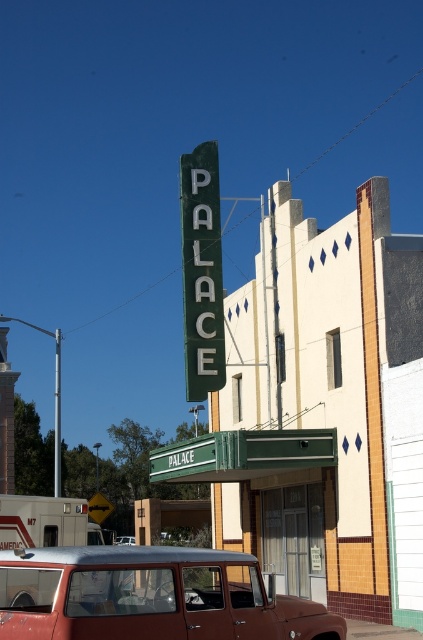
Is point (222, 611) closer to camera compared to point (187, 282)?

Yes, it is.

The image size is (423, 640). Describe the element at coordinates (150, 596) in the screenshot. I see `rustic metal station wagon at center` at that location.

Locate an element on the screen. rustic metal station wagon at center is located at coordinates coord(150,596).